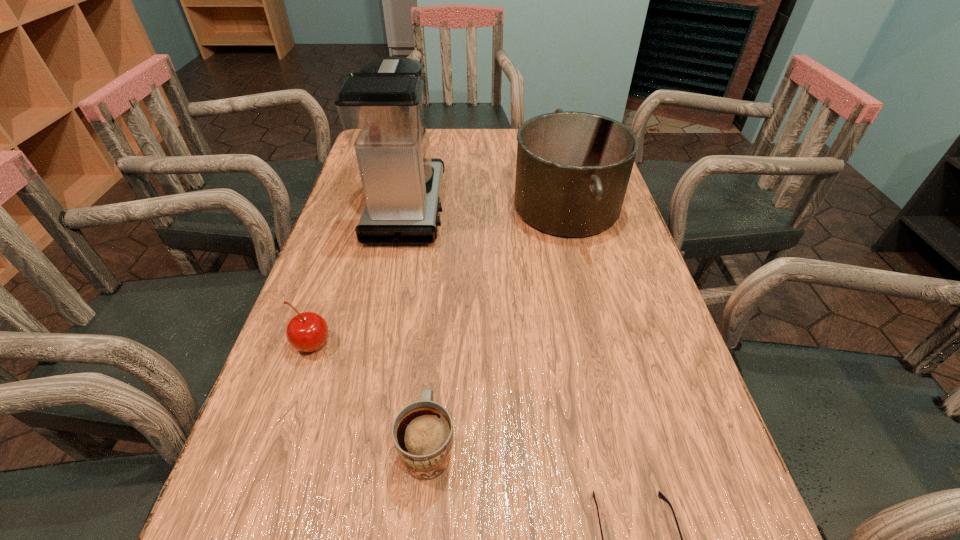
This screenshot has height=540, width=960. Find the location of `free space between the coffee maker and the second tallest object`. free space between the coffee maker and the second tallest object is located at coordinates 487,207.

Locate an element on the screen. The height and width of the screenshot is (540, 960). free space that is in between the coffee maker and the pan is located at coordinates (487, 207).

The width and height of the screenshot is (960, 540). I want to click on free spot between the fourth shortest object and the mug, so click(497, 326).

Image resolution: width=960 pixels, height=540 pixels. I want to click on the second closest object to the pan, so click(422, 432).

At what (x,y) coordinates should I click in order to perform the action: click on the second closest object to the second tallest object. Please return your answer as a coordinate pair (x, y). The image size is (960, 540). Looking at the image, I should click on (422, 432).

At what (x,y) coordinates should I click in order to perform the action: click on free space that satisfies the following two spatial constraints: 1. at the front of the coffee maker where the controls are located; 2. on the side of the mug with the handle. Please return your answer as a coordinate pair (x, y). The width and height of the screenshot is (960, 540). Looking at the image, I should click on (359, 445).

Identify the location of vacant space that satisfies the following two spatial constraints: 1. on the side of the fourth farthest object with the handle; 2. on the right side of the pan. click(x=449, y=207).

This screenshot has height=540, width=960. I want to click on blank area in the image that satisfies the following two spatial constraints: 1. at the front of the coffee maker where the controls are located; 2. on the front side of the third farthest object, so click(379, 345).